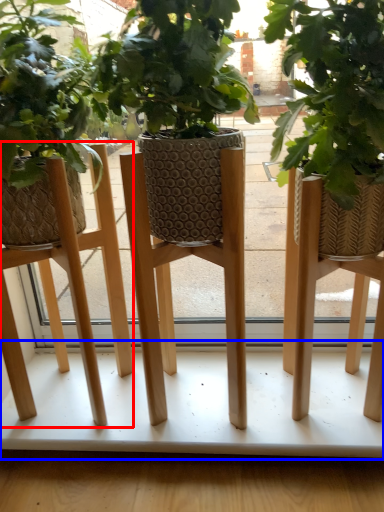
Question: Which of the following is the closest to the observer, stool (highlighted by a red box) or table (highlighted by a blue box)?

Choices:
 (A) stool
 (B) table

Answer: (A)